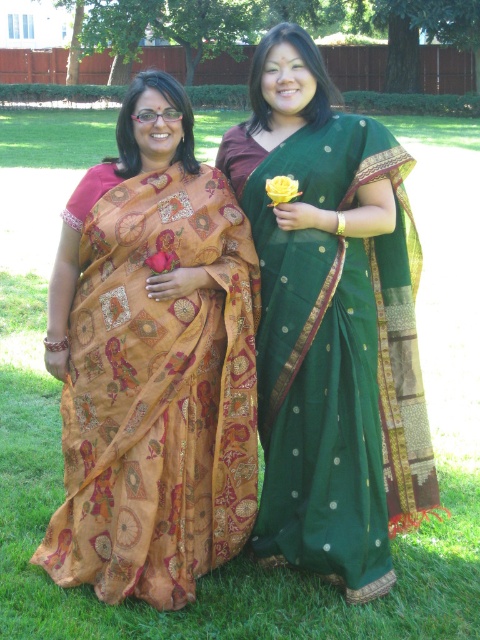
Who is lower down, matte orange sari at left or green silk saree at center?

matte orange sari at left

Measure the distance between point (79, 282) and camera.

Point (79, 282) and camera are 3.09 meters apart from each other.

What do you see at coordinates (153, 364) in the screenshot? The image size is (480, 640). I see `matte orange sari at left` at bounding box center [153, 364].

Locate an element on the screen. This screenshot has width=480, height=640. matte orange sari at left is located at coordinates (153, 364).